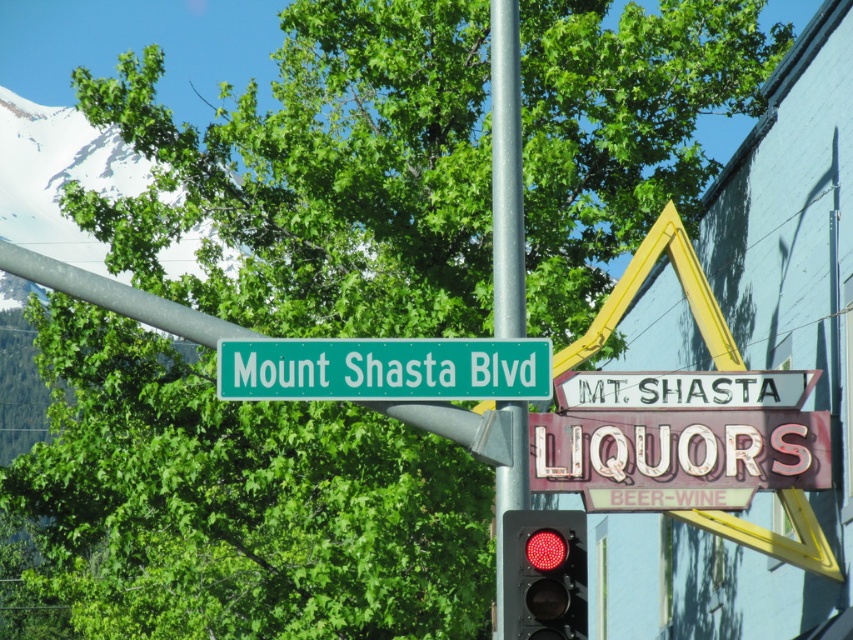
Between green metallic street sign at upper center and red glass traffic light at center, which one has less height?

Standing shorter between the two is green metallic street sign at upper center.

Does green metallic street sign at upper center have a smaller size compared to red glass traffic light at center?

Yes.

Identify the location of green metallic street sign at upper center. The height and width of the screenshot is (640, 853). (384, 369).

Is green metallic street sign at upper center closer to camera compared to metallic pole at center?

No, it is not.

Image resolution: width=853 pixels, height=640 pixels. What do you see at coordinates (384, 369) in the screenshot? I see `green metallic street sign at upper center` at bounding box center [384, 369].

The width and height of the screenshot is (853, 640). I want to click on green metallic street sign at upper center, so click(x=384, y=369).

Which is below, metallic pole at center or red glass traffic light at center?

red glass traffic light at center is below.

Who is more distant from viewer, (x=495, y=256) or (x=532, y=593)?

The point (x=495, y=256) is behind.

At what (x,y) coordinates should I click in order to perform the action: click on metallic pole at center. Please return your answer as a coordinate pair (x, y). The height and width of the screenshot is (640, 853). Looking at the image, I should click on (506, 172).